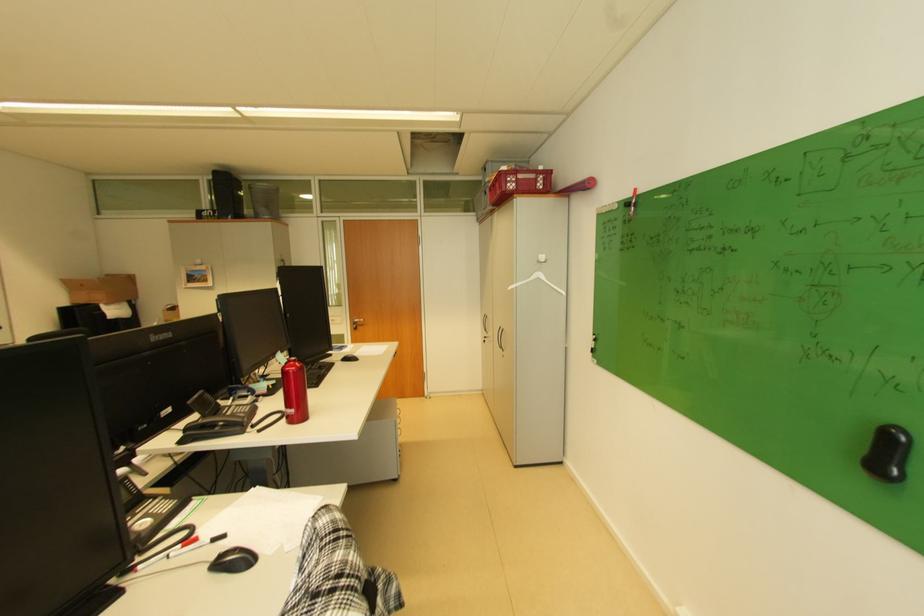
Describe the element at coordinates (504, 334) in the screenshot. I see `the curved cabinet handle` at that location.